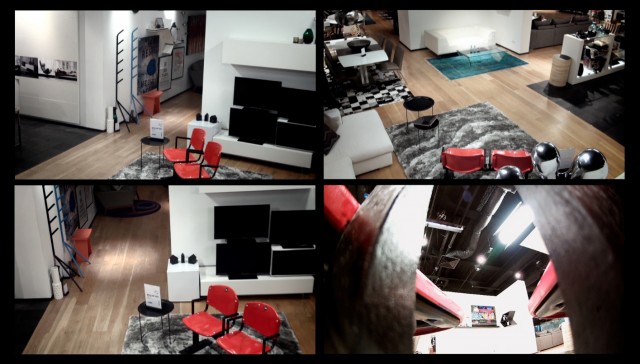
Identify the location of white couch. (365, 139).